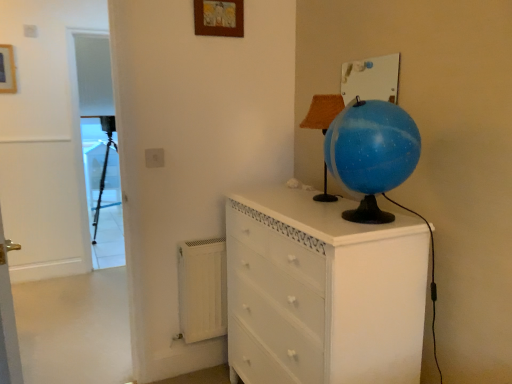
In order to face white wooden door at center, should I rotate leftwards or rightwards?

Turn left by 24.561 degrees to look at white wooden door at center.

The width and height of the screenshot is (512, 384). Identify the location of wooden picture frame at upper left, the 2th picture frame in the front-to-back sequence. (7, 70).

Where is `white plastic electric outlet at upper center`? This screenshot has height=384, width=512. white plastic electric outlet at upper center is located at coordinates (154, 158).

Measure the distance between point (275, 260) and camera.

A distance of 1.61 meters exists between point (275, 260) and camera.

Locate an element on the screen. Image resolution: width=512 pixels, height=384 pixels. white wooden door at center is located at coordinates (45, 139).

From a real-world perspective, which is physically below, white plastic electric outlet at upper center or wooden picture frame at upper left, positioned as the 1th picture frame in back-to-front order?

In real-world perspective, white plastic electric outlet at upper center is lower.

From the image's perspective, which one is positioned higher, white plastic electric outlet at upper center or wooden picture frame at upper left, which is counted as the first picture frame, starting from the left?

wooden picture frame at upper left, which is counted as the first picture frame, starting from the left, is shown above in the image.

Is white plastic electric outlet at upper center oriented away from wooden picture frame at upper left, which is counted as the first picture frame, starting from the left?

No, white plastic electric outlet at upper center is not facing the opposite direction of wooden picture frame at upper left, which is counted as the first picture frame, starting from the left.

Which is less distant, (100, 185) or (198, 27)?

The point (198, 27) is more forward.

Which is more to the left, matte black tripod at left or wooden picture frame at upper center, the 2th picture frame positioned from the back?

Positioned to the left is matte black tripod at left.

What are the coordinates of `picture frame on the right side of matte black tripod at left` in the screenshot? It's located at (219, 18).

Who is bigger, matte black tripod at left or wooden picture frame at upper center, which is the first picture frame in right-to-left order?

With larger size is matte black tripod at left.

Does white plastic electric outlet at upper center turn towards wooden picture frame at upper center, the 1th picture frame in the front-to-back sequence?

No, white plastic electric outlet at upper center does not turn towards wooden picture frame at upper center, the 1th picture frame in the front-to-back sequence.

Is white plastic electric outlet at upper center taller than wooden picture frame at upper center, the 2th picture frame positioned from the back?

Incorrect, the height of white plastic electric outlet at upper center is not larger of that of wooden picture frame at upper center, the 2th picture frame positioned from the back.

Does white plastic electric outlet at upper center have a larger size compared to wooden picture frame at upper center, the second picture frame from the left?

Actually, white plastic electric outlet at upper center might be smaller than wooden picture frame at upper center, the second picture frame from the left.

From the image's perspective, which one is positioned higher, white plastic electric outlet at upper center or wooden picture frame at upper center, the second picture frame from the left?

wooden picture frame at upper center, the second picture frame from the left, from the image's perspective.

From the image's perspective, is burlap-textured lampshade at upper center positioned above or below white plastic electric outlet at upper center?

burlap-textured lampshade at upper center is above white plastic electric outlet at upper center.

Looking at this image, does burlap-textured lampshade at upper center touch white plastic electric outlet at upper center?

No, burlap-textured lampshade at upper center is not next to white plastic electric outlet at upper center.

Does point (324, 97) lie in front of point (156, 157)?

That is True.

From a real-world perspective, is blue glossy globe at upper right below white matte radiator at lower left?

Actually, blue glossy globe at upper right is physically above white matte radiator at lower left in the real world.

Can you tell me how much blue glossy globe at upper right and white matte radiator at lower left differ in facing direction?

The facing directions of blue glossy globe at upper right and white matte radiator at lower left are 90.9 degrees apart.

Could you tell me if blue glossy globe at upper right is facing white matte radiator at lower left?

No, blue glossy globe at upper right does not turn towards white matte radiator at lower left.

Between blue glossy globe at upper right and white matte radiator at lower left, which one appears on the right side from the viewer's perspective?

From the viewer's perspective, blue glossy globe at upper right appears more on the right side.

Which of these two, wooden picture frame at upper center, which is the first picture frame in right-to-left order, or white wooden door at center, stands taller?

Standing taller between the two is white wooden door at center.

The height and width of the screenshot is (384, 512). What are the coordinates of `picture frame located on the right of white wooden door at center` in the screenshot? It's located at (219, 18).

What's the angular difference between wooden picture frame at upper center, the 2th picture frame positioned from the back, and white wooden door at center's facing directions?

They differ by 0.879 degrees in their facing directions.

Which point is more distant from viewer, (205, 7) or (95, 191)?

The point (95, 191) is farther from the camera.

In order to click on screen door on the left of wooden picture frame at upper center, the second picture frame from the left in this screenshot , I will do `click(97, 143)`.

Is wooden picture frame at upper center, the 2th picture frame positioned from the back, situated inside transparent plastic screen door at left or outside?

wooden picture frame at upper center, the 2th picture frame positioned from the back, lies outside transparent plastic screen door at left.

Locate an element on the screen. This screenshot has width=512, height=384. the 1st picture frame above the white plastic electric outlet at upper center (from a real-world perspective) is located at coordinates (7, 70).

This screenshot has height=384, width=512. I want to click on tripod beneath the wooden picture frame at upper center, the 2th picture frame positioned from the back (from a real-world perspective), so click(103, 185).

Which object lies nearer to the anchor point white matte radiator at lower left, white painted wood chest of drawers at center or transparent plastic screen door at left?

white painted wood chest of drawers at center is positioned closer to the anchor white matte radiator at lower left.

Based on their spatial positions, is matte black tripod at left or white wooden door at center further from blue glossy globe at upper right?

matte black tripod at left is further to blue glossy globe at upper right.

Considering their positions, is wooden picture frame at upper left, positioned as the 1th picture frame in back-to-front order, positioned closer to white plastic electric outlet at upper center than matte black tripod at left?

Among the two, wooden picture frame at upper left, positioned as the 1th picture frame in back-to-front order, is located nearer to white plastic electric outlet at upper center.

Considering their positions, is matte black tripod at left positioned further to blue glossy globe at upper right than wooden picture frame at upper left, positioned as the 1th picture frame in back-to-front order?

Based on the image, matte black tripod at left appears to be further to blue glossy globe at upper right.

Which object lies further to the anchor point white painted wood chest of drawers at center, white plastic electric outlet at upper center or matte black tripod at left?

matte black tripod at left is further to white painted wood chest of drawers at center.

Which object lies nearer to the anchor point wooden picture frame at upper left, positioned as the 1th picture frame in back-to-front order, burlap-textured lampshade at upper center or matte black tripod at left?

matte black tripod at left.

Which object lies nearer to the anchor point matte black tripod at left, white wooden door at center or transparent plastic screen door at left?

Based on the image, transparent plastic screen door at left appears to be nearer to matte black tripod at left.

Looking at this image, which object lies nearer to the anchor point white wooden door at center, transparent plastic screen door at left or blue glossy globe at upper right?

transparent plastic screen door at left is closer to white wooden door at center.

This screenshot has height=384, width=512. I want to click on table lamp located between blue glossy globe at upper right and matte black tripod at left in the depth direction, so click(323, 111).

Locate an element on the screen. The height and width of the screenshot is (384, 512). door situated between wooden picture frame at upper left, which is counted as the first picture frame, starting from the left, and wooden picture frame at upper center, the 1th picture frame in the front-to-back sequence, from left to right is located at coordinates (45, 139).

Where is `picture frame between white plastic electric outlet at upper center and matte black tripod at left in the front-back direction`? The width and height of the screenshot is (512, 384). picture frame between white plastic electric outlet at upper center and matte black tripod at left in the front-back direction is located at coordinates (7, 70).

Identify the location of screen door between wooden picture frame at upper left, positioned as the 1th picture frame in back-to-front order, and white matte radiator at lower left. Image resolution: width=512 pixels, height=384 pixels. (97, 143).